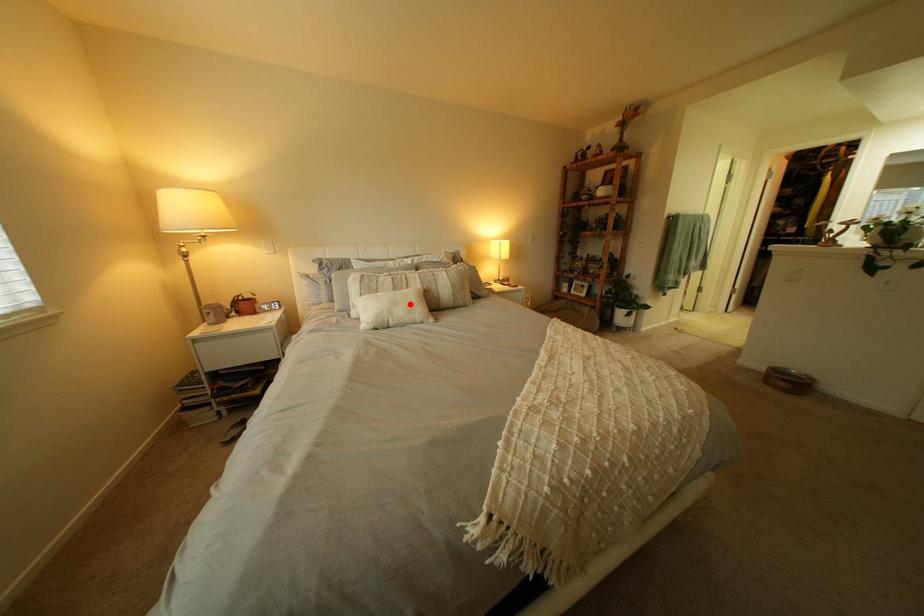
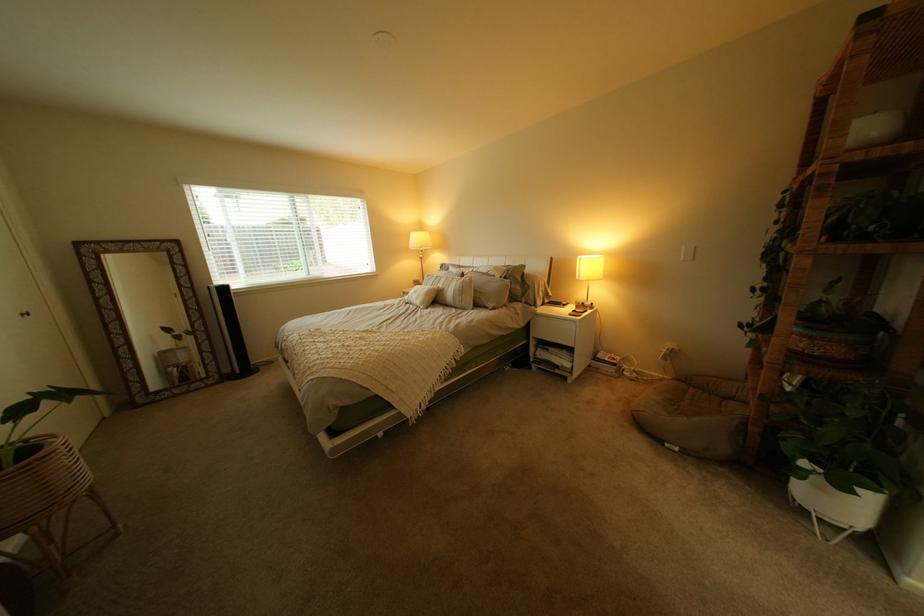
The point at the highlighted location is marked in the first image. Where is the corresponding point in the second image?

(431, 293)